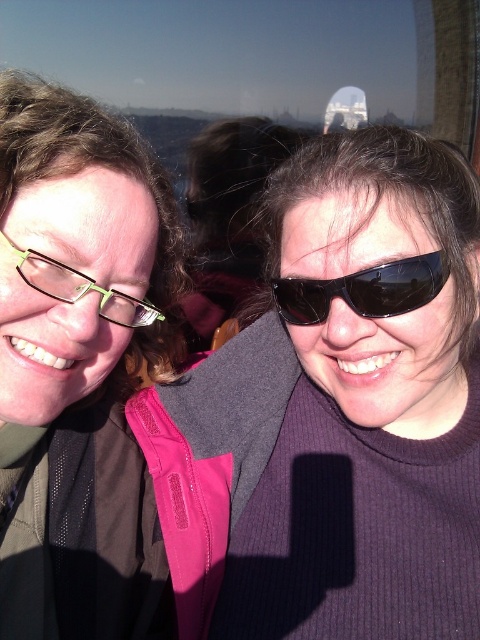
Does point (370, 269) lie behind point (48, 289)?

Yes, it is.

Who is higher up, black reflective sunglasses at center or green plastic glasses at left?

Positioned higher is black reflective sunglasses at center.

Does point (414, 257) come closer to viewer compared to point (146, 305)?

Yes, point (414, 257) is closer to viewer.

Find the location of a particular element. This screenshot has width=480, height=640. black reflective sunglasses at center is located at coordinates (363, 289).

Does matte green glasses at left have a lesser width compared to green plastic glasses at left?

No, matte green glasses at left is not thinner than green plastic glasses at left.

Does matte green glasses at left appear under green plastic glasses at left?

Yes, matte green glasses at left is below green plastic glasses at left.

Identify the location of matte green glasses at left. (79, 365).

This screenshot has width=480, height=640. Find the location of `matte green glasses at left`. matte green glasses at left is located at coordinates (79, 365).

Is matte green glasses at left below black reflective sunglasses at center?

Correct, matte green glasses at left is located below black reflective sunglasses at center.

Where is `matte green glasses at left`? Image resolution: width=480 pixels, height=640 pixels. matte green glasses at left is located at coordinates (79, 365).